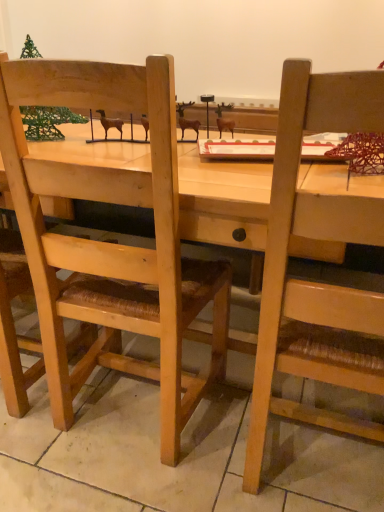
Question: From a real-world perspective, is green wire christmas tree at upper left positioned under wooden chair at right, which appears as the 2th chair when viewed from the left, based on gravity?

Choices:
 (A) yes
 (B) no

Answer: (B)

Question: Is green wire christmas tree at upper left not near wooden chair at right, which appears as the 2th chair when viewed from the left?

Choices:
 (A) yes
 (B) no

Answer: (A)

Question: From a real-world perspective, is green wire christmas tree at upper left physically above wooden chair at right, arranged as the 1th chair when viewed from the right?

Choices:
 (A) no
 (B) yes

Answer: (B)

Question: Is green wire christmas tree at upper left located outside wooden chair at right, arranged as the 1th chair when viewed from the right?

Choices:
 (A) no
 (B) yes

Answer: (B)

Question: From the image's perspective, does green wire christmas tree at upper left appear higher than wooden chair at right, arranged as the 1th chair when viewed from the right?

Choices:
 (A) no
 (B) yes

Answer: (B)

Question: Is green wire christmas tree at upper left behind wooden chair at right, arranged as the 1th chair when viewed from the right?

Choices:
 (A) no
 (B) yes

Answer: (B)

Question: Is wooden chair at left, which appears as the second chair when viewed from the right, touching wooden chair at right, which appears as the 2th chair when viewed from the left?

Choices:
 (A) no
 (B) yes

Answer: (A)

Question: From the image's perspective, does wooden chair at left, which appears as the second chair when viewed from the right, appear higher than wooden chair at right, arranged as the 1th chair when viewed from the right?

Choices:
 (A) yes
 (B) no

Answer: (A)

Question: Would you say wooden chair at right, which appears as the 2th chair when viewed from the left, is part of wooden chair at left, the first chair when ordered from left to right,'s contents?

Choices:
 (A) yes
 (B) no

Answer: (B)

Question: Is wooden chair at left, the first chair when ordered from left to right, turned away from wooden chair at right, which appears as the 2th chair when viewed from the left?

Choices:
 (A) yes
 (B) no

Answer: (B)

Question: Considering the relative sizes of wooden chair at left, the first chair when ordered from left to right, and wooden chair at right, which appears as the 2th chair when viewed from the left, in the image provided, is wooden chair at left, the first chair when ordered from left to right, wider than wooden chair at right, which appears as the 2th chair when viewed from the left,?

Choices:
 (A) yes
 (B) no

Answer: (B)

Question: Does wooden chair at left, the first chair when ordered from left to right, have a lesser height compared to wooden chair at right, which appears as the 2th chair when viewed from the left?

Choices:
 (A) no
 (B) yes

Answer: (A)

Question: Can you confirm if wooden chair at right, arranged as the 1th chair when viewed from the right, is wider than green wire christmas tree at upper left?

Choices:
 (A) no
 (B) yes

Answer: (B)